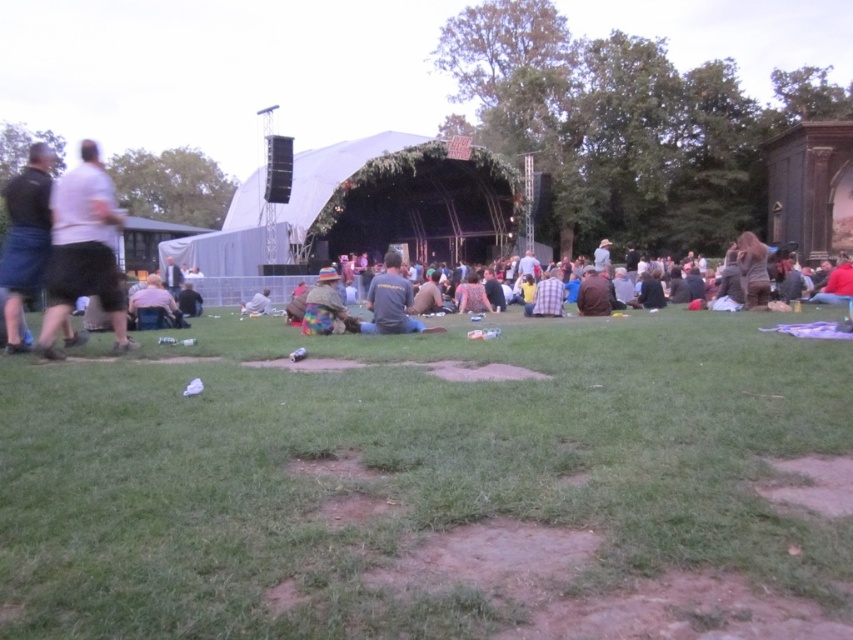
Question: Which is farther from the camouflage-patterned jacket at center?

Choices:
 (A) light gray cotton shorts at left
 (B) denim shorts at left
 (C) multicolored fabric hat at center
 (D) green grass at lower center

Answer: (D)

Question: Is green grass at lower center closer to camera compared to light gray cotton shorts at left?

Choices:
 (A) yes
 (B) no

Answer: (A)

Question: Which object is the closest to the plaid shirt at center?

Choices:
 (A) light gray cotton shorts at left
 (B) camouflage-patterned jacket at center
 (C) multicolored fabric hat at center

Answer: (C)

Question: In this image, where is green grass at lower center located relative to multicolored fabric hat at center?

Choices:
 (A) below
 (B) above

Answer: (A)

Question: Is light gray cotton shorts at left to the left of dark gray t-shirt at center from the viewer's perspective?

Choices:
 (A) no
 (B) yes

Answer: (B)

Question: Which of the following is the closest to the observer?

Choices:
 (A) (538, 538)
 (B) (256, 298)

Answer: (A)